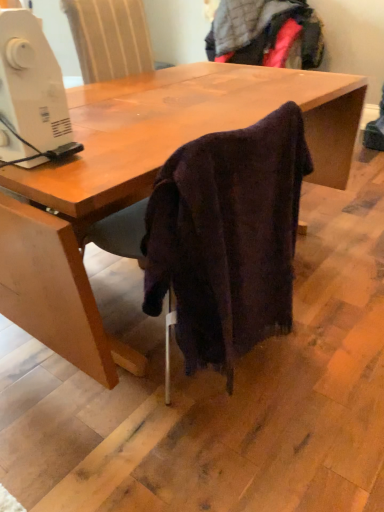
I want to click on space that is in front of dark woolen sweater at lower center, so click(190, 446).